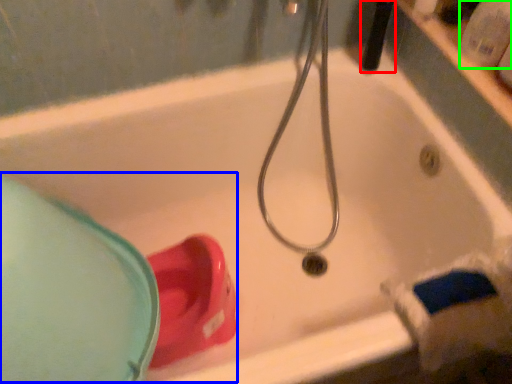
Question: Considering the real-world distances, which object is farthest from shower (highlighted by a red box)? sink (highlighted by a blue box) or toiletry (highlighted by a green box)?

Choices:
 (A) sink
 (B) toiletry

Answer: (A)